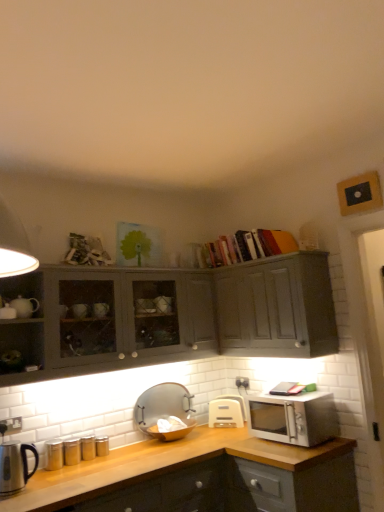
Question: From the image's perspective, is stainless steel kettle at left, the 1th appliance positioned from the left, positioned above or below matte gray cabinet at upper left, the 1th cabinetry when ordered from left to right?

Choices:
 (A) above
 (B) below

Answer: (B)

Question: Is stainless steel kettle at left, the 1th appliance positioned from the left, situated inside matte gray cabinet at upper left, which is the second cabinetry from right to left, or outside?

Choices:
 (A) inside
 (B) outside

Answer: (B)

Question: Considering the real-world distances, which object is farthest from the matte gray cabinet at upper left, the 1th cabinetry when ordered from left to right?

Choices:
 (A) satin silver microwave at right
 (B) stainless steel kettle at left, which is the 1th appliance from front to back
 (C) matte gray cabinet at upper right, marked as the 2th cabinetry in a left-to-right arrangement
 (D) white plastic toaster at center, the 3th appliance positioned from the front
 (E) transparent glass bowl at center, the second appliance positioned from the back

Answer: (B)

Question: Which object is the farthest from the white plastic electric outlet at lower left?

Choices:
 (A) white plastic toaster at center, which is the first appliance from back to front
 (B) matte gray cabinet at upper left, which is the second cabinetry from right to left
 (C) satin silver microwave at right
 (D) matte gray cabinet at upper right, marked as the 2th cabinetry in a left-to-right arrangement
 (E) transparent glass bowl at center, the second appliance positioned from the back

Answer: (D)